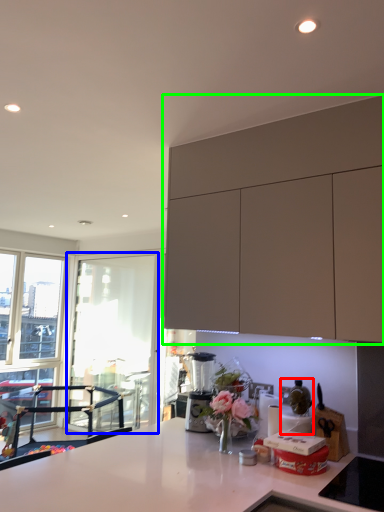
Question: Based on their relative distances, which object is nearer to appliance (highlighted by a red box)? Choose from window screen (highlighted by a blue box) and cabinetry (highlighted by a green box).

Choices:
 (A) window screen
 (B) cabinetry

Answer: (B)